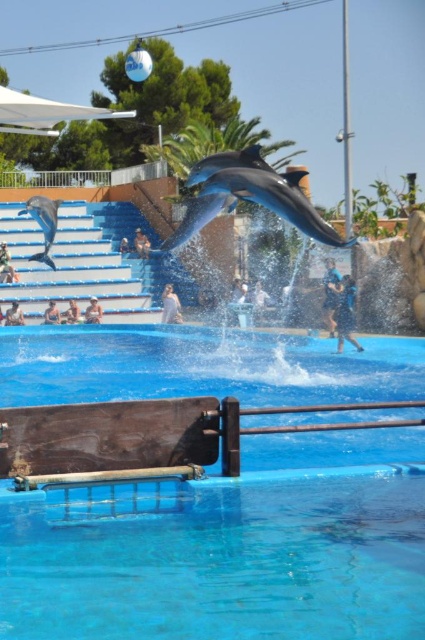
In the scene shown: Is shiny gray dolphin at center bigger than blue fabric trainer at center?

Correct, shiny gray dolphin at center is larger in size than blue fabric trainer at center.

Which of these two, shiny gray dolphin at center or blue fabric trainer at center, stands shorter?

With less height is blue fabric trainer at center.

Is point (309, 212) farther from viewer compared to point (329, 288)?

No.

Where is `shiny gray dolphin at center`? shiny gray dolphin at center is located at coordinates (249, 195).

Is point (351, 566) less distant than point (47, 262)?

That is True.

How distant is blue smooth water at center from smooth gray dolphin at left?

blue smooth water at center and smooth gray dolphin at left are 7.09 meters apart.

Find the location of a particular element. Image resolution: width=425 pixels, height=640 pixels. blue smooth water at center is located at coordinates (229, 548).

Between point (36, 259) and point (331, 284), which one is positioned behind?

Point (331, 284)

Is point (27, 205) positioned behind point (328, 301)?

Yes, point (27, 205) is behind point (328, 301).

The image size is (425, 640). What do you see at coordinates (44, 224) in the screenshot? I see `smooth gray dolphin at left` at bounding box center [44, 224].

The image size is (425, 640). What are the coordinates of `smooth gray dolphin at left` in the screenshot? It's located at (44, 224).